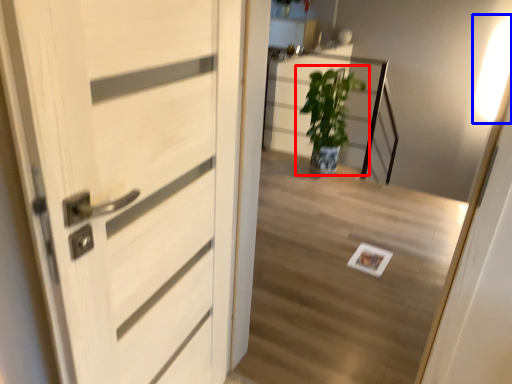
Question: Among these objects, which one is nearest to the camera, houseplant (highlighted by a red box) or light (highlighted by a blue box)?

Choices:
 (A) houseplant
 (B) light

Answer: (A)